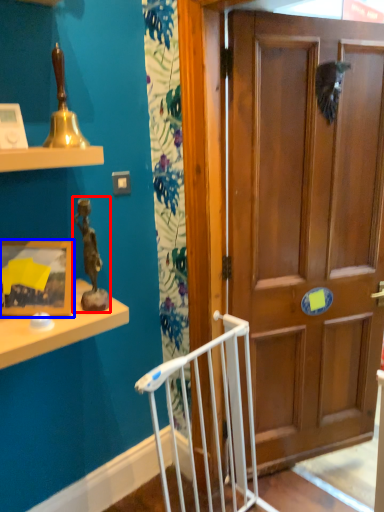
Question: Among these objects, which one is nearest to the camera, toy (highlighted by a red box) or picture frame (highlighted by a blue box)?

Choices:
 (A) toy
 (B) picture frame

Answer: (A)